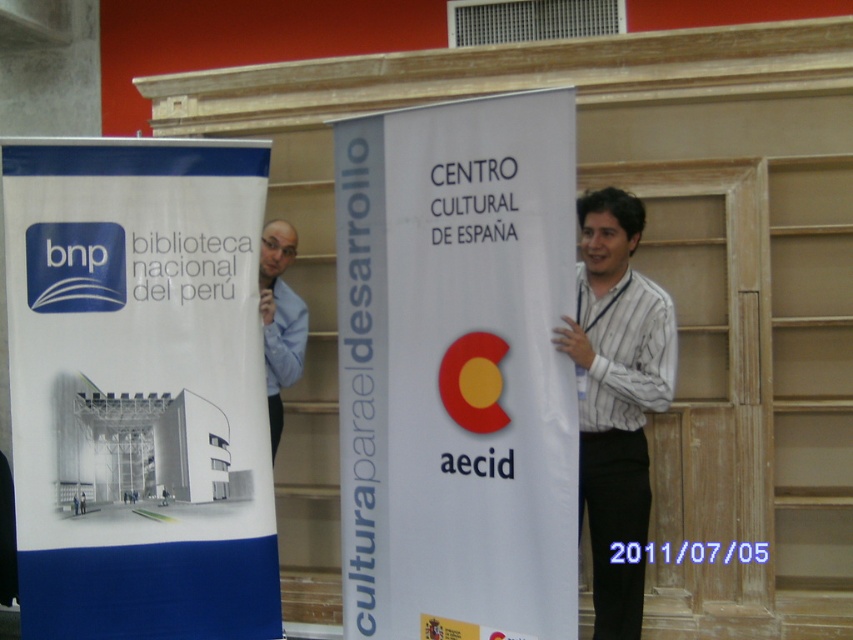
Based on the photo, which of these two, white paper banner at center or white striped shirt at center, stands shorter?

white striped shirt at center

Measure the distance from white paper banner at center to white striped shirt at center.

They are 20.25 inches apart.

Find the location of a particular element. The image size is (853, 640). white paper banner at center is located at coordinates (457, 369).

Is white striped shirt at center below blue shirt at left?

Yes, white striped shirt at center is below blue shirt at left.

Is point (654, 358) less distant than point (270, 371)?

Yes, point (654, 358) is in front of point (270, 371).

Find the location of a particular element. This screenshot has height=640, width=853. white striped shirt at center is located at coordinates (616, 397).

The height and width of the screenshot is (640, 853). What do you see at coordinates (457, 369) in the screenshot?
I see `white paper banner at center` at bounding box center [457, 369].

Can you confirm if white paper banner at center is positioned below blue shirt at left?

Correct, white paper banner at center is located below blue shirt at left.

You are a GUI agent. You are given a task and a screenshot of the screen. Output one action in this format:
    pyautogui.click(x=<x>, y=<y>)
    Task: Click on the white paper banner at center
    The width and height of the screenshot is (853, 640).
    Given the screenshot: What is the action you would take?
    pyautogui.click(x=457, y=369)